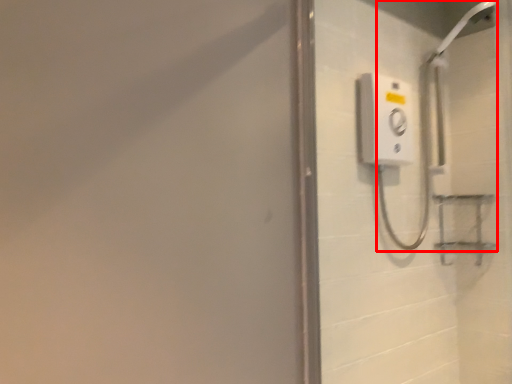
Question: From the image's perspective, what is the correct spatial relationship of shower (annotated by the red box) in relation to screen door?

Choices:
 (A) below
 (B) above

Answer: (B)